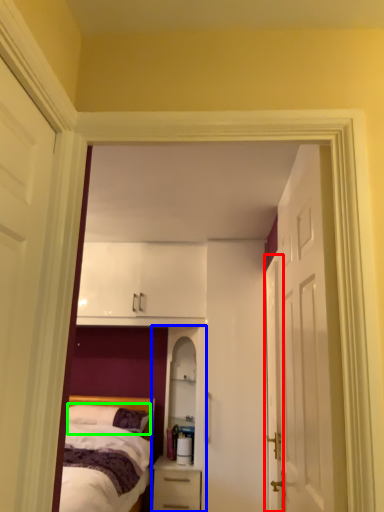
Question: Based on their relative distances, which object is nearer to door (highlighted by a red box)? Choose from dresser (highlighted by a blue box) and pillow (highlighted by a green box).

Choices:
 (A) dresser
 (B) pillow

Answer: (A)